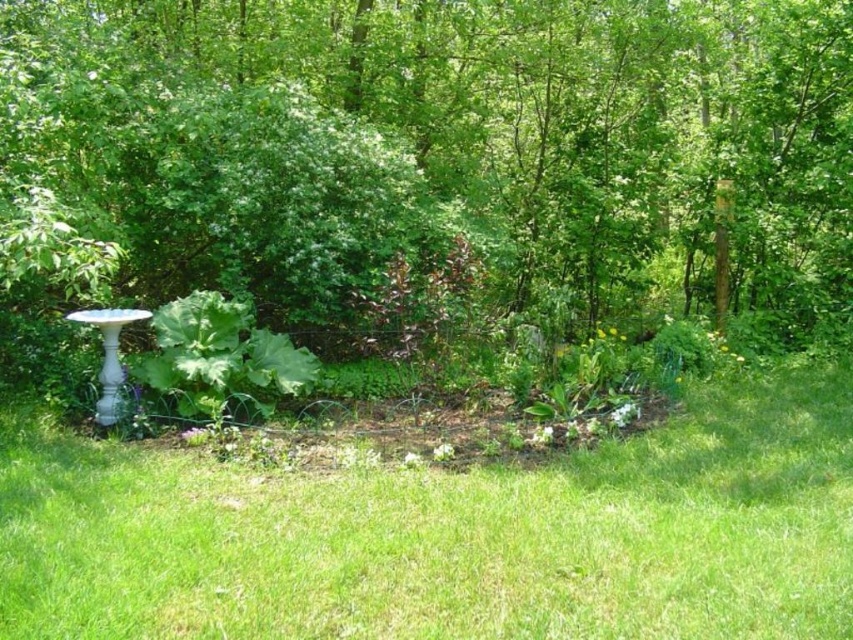
Question: Which point is farther to the camera?

Choices:
 (A) green leafy tree at center
 (B) green grass at lower center

Answer: (A)

Question: Can you confirm if green leafy tree at center is positioned below green grass at lower center?

Choices:
 (A) yes
 (B) no

Answer: (B)

Question: Is the position of green leafy tree at center more distant than that of green grass at lower center?

Choices:
 (A) yes
 (B) no

Answer: (A)

Question: Is green leafy tree at center smaller than green grass at lower center?

Choices:
 (A) yes
 (B) no

Answer: (A)

Question: Which point is closer to the camera?

Choices:
 (A) green grass at lower center
 (B) green leafy tree at center

Answer: (A)